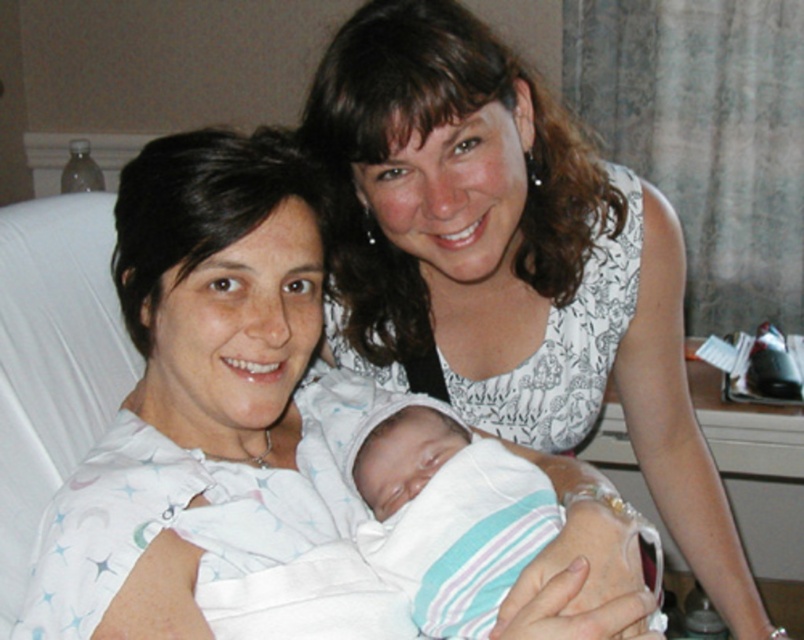
Question: Which object is closer to the camera taking this photo?

Choices:
 (A) white fabric baby at center
 (B) white striped fabric at center

Answer: (A)

Question: Can you confirm if white fabric baby at center is positioned to the left of white striped fabric at center?

Choices:
 (A) no
 (B) yes

Answer: (B)

Question: Which of the following is the closest to the observer?

Choices:
 (A) white striped fabric at center
 (B) white fabric baby at center

Answer: (B)

Question: Can you confirm if white fabric baby at center is smaller than white striped fabric at center?

Choices:
 (A) yes
 (B) no

Answer: (B)

Question: Is white fabric baby at center bigger than white striped fabric at center?

Choices:
 (A) no
 (B) yes

Answer: (B)